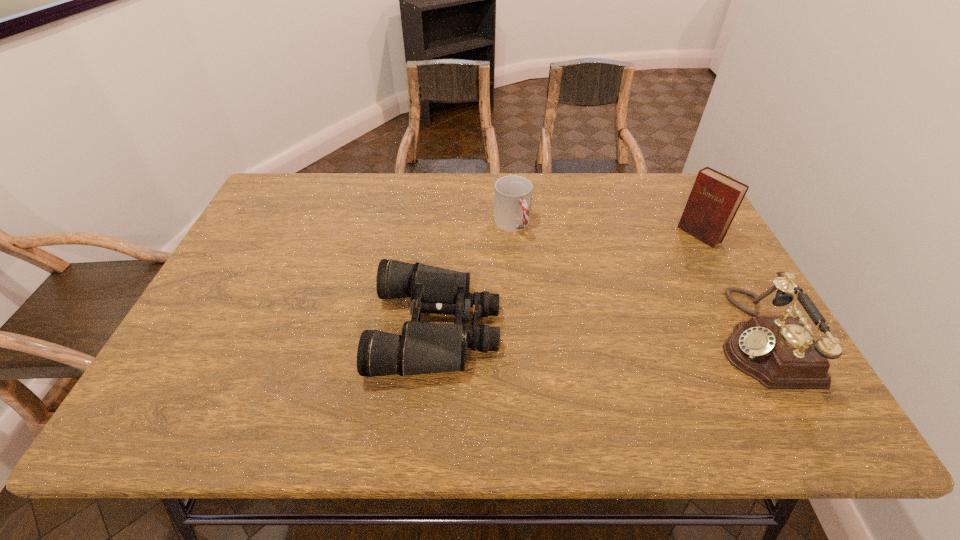
You are a GUI agent. You are given a task and a screenshot of the screen. Output one action in this format:
    pyautogui.click(x=<x>, y=<y>)
    Task: Click on the vacant area situated on the handle side of the third tallest object
    This screenshot has width=960, height=540.
    Given the screenshot: What is the action you would take?
    pyautogui.click(x=548, y=282)

Locate an element on the screen. The image size is (960, 540). vacant space located 0.230m on the front cover of the diary is located at coordinates (636, 277).

The height and width of the screenshot is (540, 960). Identify the location of vacant area located 0.290m on the front cover of the diary. (621, 287).

This screenshot has width=960, height=540. What are the coordinates of `blank space located 0.170m on the front cover of the diary` in the screenshot? It's located at [651, 268].

Image resolution: width=960 pixels, height=540 pixels. I want to click on object that is at the far edge, so tap(513, 194).

At what (x,y) coordinates should I click in order to perform the action: click on binoculars located at the near edge. Please return your answer as a coordinate pair (x, y). The image size is (960, 540). Looking at the image, I should click on (423, 348).

The image size is (960, 540). Find the location of `telephone located in the near edge section of the desktop`. telephone located in the near edge section of the desktop is located at coordinates (779, 352).

Where is `telephone present at the right edge`? The width and height of the screenshot is (960, 540). telephone present at the right edge is located at coordinates (779, 352).

This screenshot has height=540, width=960. I want to click on diary at the right edge, so click(x=715, y=198).

Image resolution: width=960 pixels, height=540 pixels. Find the location of `object at the near right corner`. object at the near right corner is located at coordinates (779, 352).